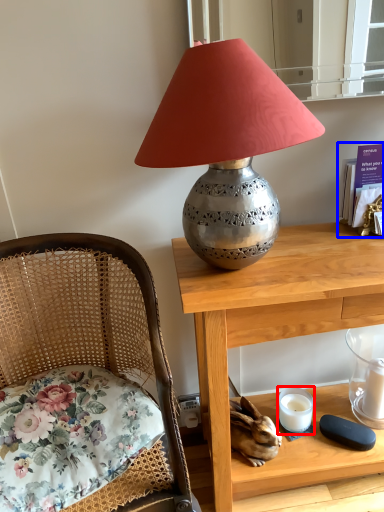
Question: Which object is further to the camera taking this photo, candle holder (highlighted by a red box) or book (highlighted by a blue box)?

Choices:
 (A) candle holder
 (B) book

Answer: (A)